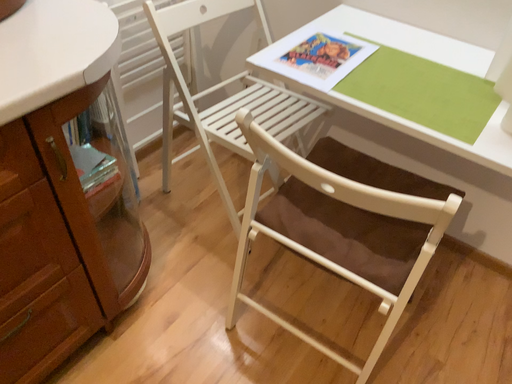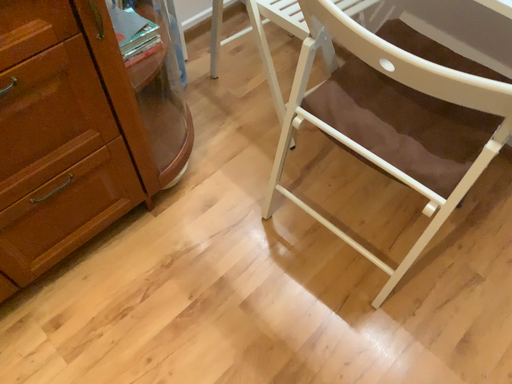
Question: Which way did the camera rotate in the video?

Choices:
 (A) rotated downward
 (B) rotated upward

Answer: (A)